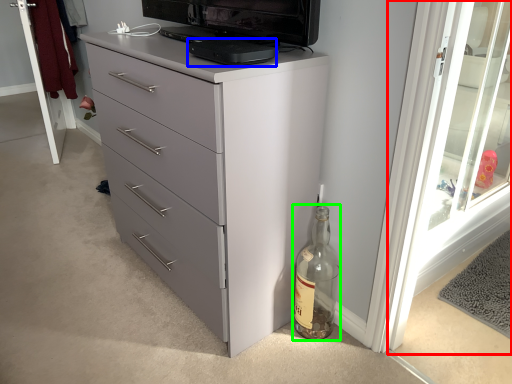
Question: Which is farther away from screen door (highlighted by a red box)? appliance (highlighted by a blue box) or glass bottle (highlighted by a green box)?

Choices:
 (A) appliance
 (B) glass bottle

Answer: (A)